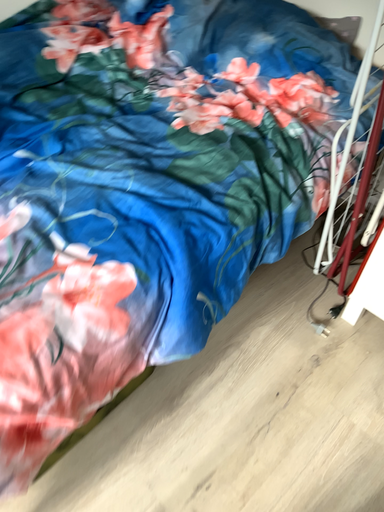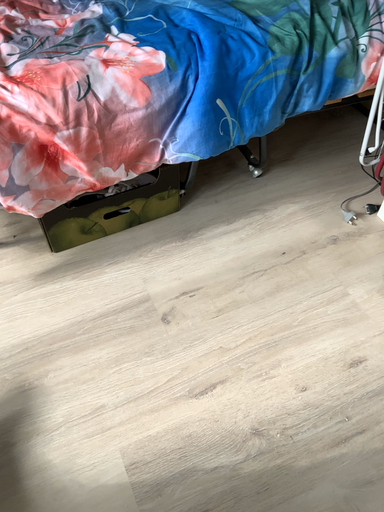
Question: Which way did the camera rotate in the video?

Choices:
 (A) rotated right
 (B) rotated left

Answer: (B)